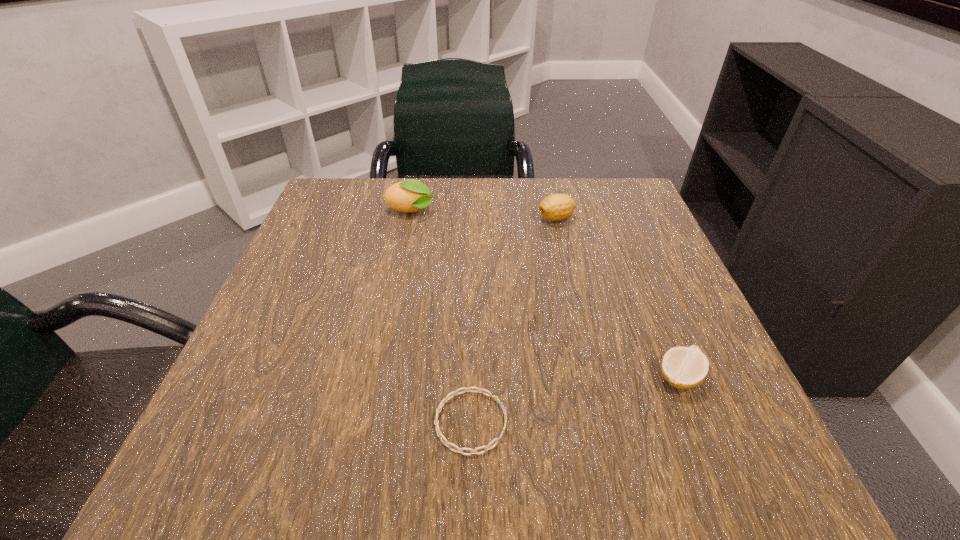
Identify the location of the tallest lemon. The height and width of the screenshot is (540, 960). (411, 195).

Identify the location of the tallest object. (411, 195).

Locate an element on the screen. This screenshot has height=540, width=960. the third shortest object is located at coordinates (556, 207).

The height and width of the screenshot is (540, 960). Find the location of `the second object from right to left`. the second object from right to left is located at coordinates (556, 207).

Where is `the rightmost lemon`? The height and width of the screenshot is (540, 960). the rightmost lemon is located at coordinates (684, 368).

At what (x,y) coordinates should I click in order to perform the action: click on the shortest lemon. Please return your answer as a coordinate pair (x, y). This screenshot has width=960, height=540. Looking at the image, I should click on (684, 368).

Locate an element on the screen. Image resolution: width=960 pixels, height=540 pixels. the third object from right to left is located at coordinates (459, 450).

This screenshot has width=960, height=540. I want to click on bracelet, so click(459, 450).

Find the location of a particular element. This screenshot has height=540, width=960. vacant space located 0.240m with leaves positioned above the leftmost object is located at coordinates (541, 212).

The height and width of the screenshot is (540, 960). I want to click on free space located 0.290m at the stem end of the second tallest object, so click(408, 219).